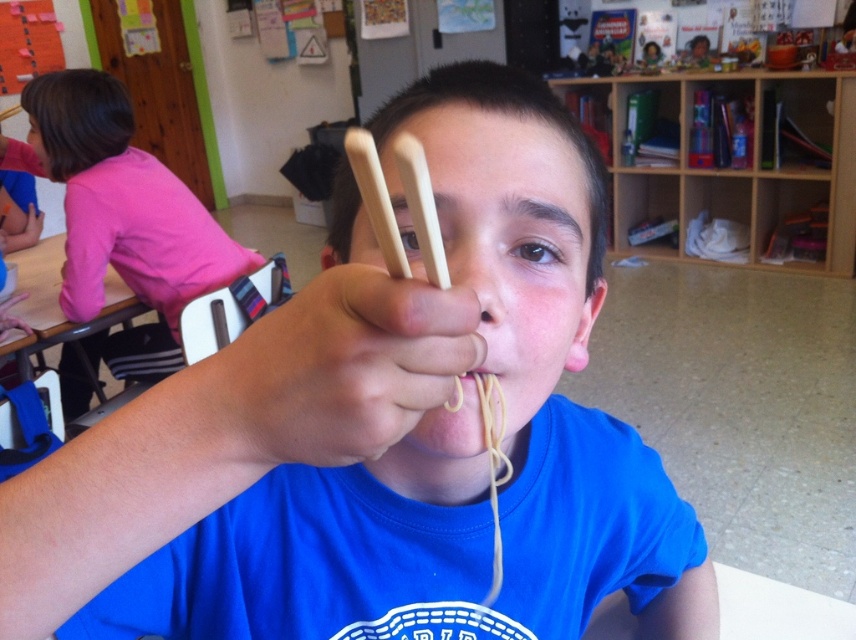
How far apart are wooden chopsticks at center and pink fabric shirt at upper left?

1.91 meters

Does wooden chopsticks at center have a larger size compared to pink fabric shirt at upper left?

Incorrect, wooden chopsticks at center is not larger than pink fabric shirt at upper left.

What are the coordinates of `wooden chopsticks at center` in the screenshot? It's located at (343, 368).

Who is more forward, (324, 324) or (477, 372)?

Positioned in front is point (324, 324).

Which of these two, wooden chopsticks at center or yellow matte spaghetti at center, stands taller?

wooden chopsticks at center

Does point (245, 390) come closer to viewer compared to point (479, 378)?

Yes, it is.

Identify the location of wooden chopsticks at center. (343, 368).

Is pink fabric shirt at upper left taller than yellow matte spaghetti at center?

Indeed, pink fabric shirt at upper left has a greater height compared to yellow matte spaghetti at center.

Who is more distant from viewer, (207, 234) or (465, 372)?

Point (207, 234)

Find the location of a particular element. This screenshot has width=856, height=640. pink fabric shirt at upper left is located at coordinates (117, 200).